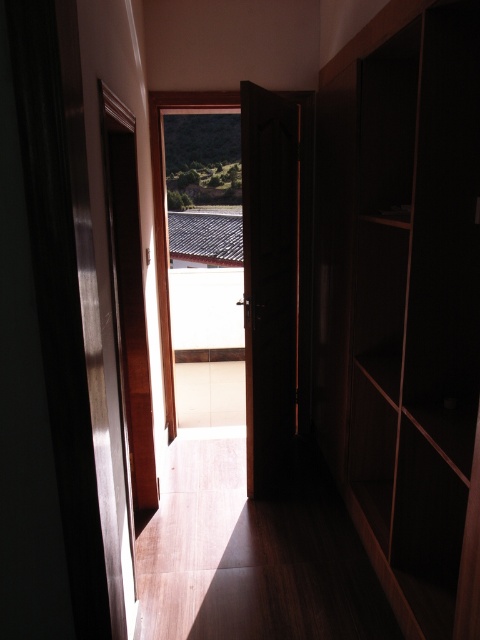
Question: Does dark wood cabinet at right appear on the right side of dark wood door at center?

Choices:
 (A) yes
 (B) no

Answer: (A)

Question: Is dark wood cabinet at right wider than dark wood door at center?

Choices:
 (A) no
 (B) yes

Answer: (B)

Question: Which object is farther from the camera taking this photo?

Choices:
 (A) dark wood cabinet at right
 (B) dark wood door at center

Answer: (B)

Question: In this image, where is dark wood cabinet at right located relative to dark wood door at center?

Choices:
 (A) below
 (B) above

Answer: (B)

Question: Among these points, which one is farthest from the camera?

Choices:
 (A) (382, 72)
 (B) (266, 301)

Answer: (B)